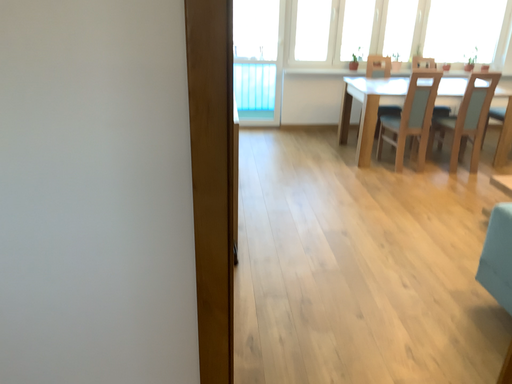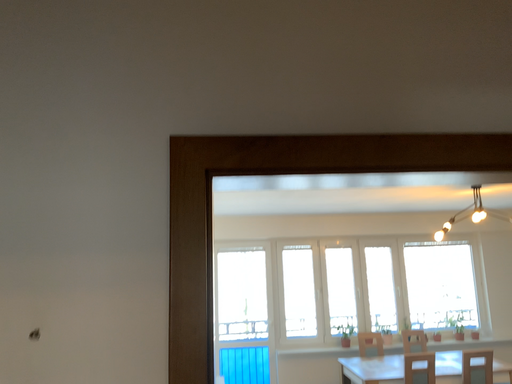
Question: Which way did the camera rotate in the video?

Choices:
 (A) rotated upward
 (B) rotated downward

Answer: (A)